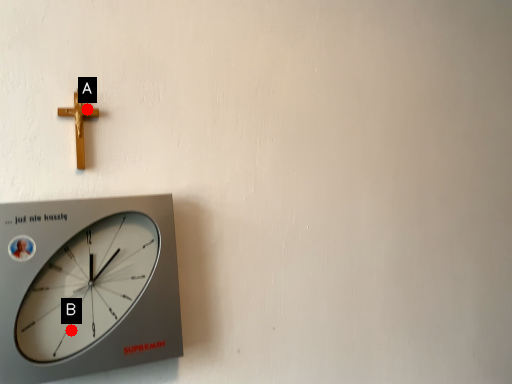
Question: Two points are circled on the image, labeled by A and B beside each circle. Which of the following is the farthest from the observer?

Choices:
 (A) A is further
 (B) B is further

Answer: (A)